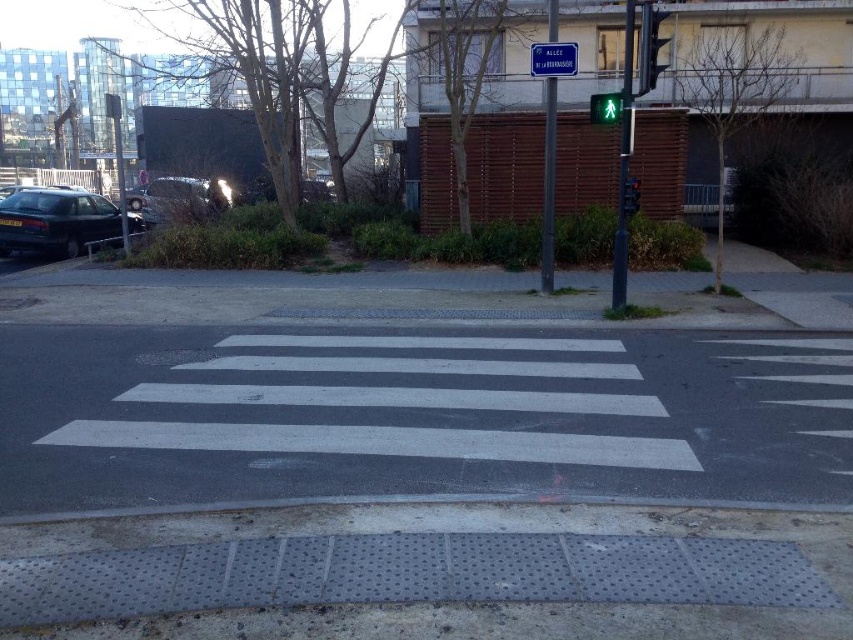
You are a city planner designing a new crosswalk. You want to ensure that the crosswalk is wide enough for pedestrians. Given that the metallic traffic light at center right is 2 meters wide, what should be the minimum width of the white asphalt crosswalk at center to accommodate pedestrian traffic comfortably?

The white asphalt crosswalk at center is larger in width than the metallic traffic light at center right. Since the traffic light is 2 meters wide, the crosswalk must be wider than 2 meters to accommodate pedestrian traffic comfortably.

You are standing at the point marked by coordinate point (408,422) in the image. What object are you standing on?

You are standing on the white asphalt crosswalk at center.

You are a pedestrian waiting at the crosswalk. You see a shiny black car at left and a metallic traffic light at upper right. Which object is higher up in the image?

The metallic traffic light at upper right is higher up in the image than the shiny black car at left.